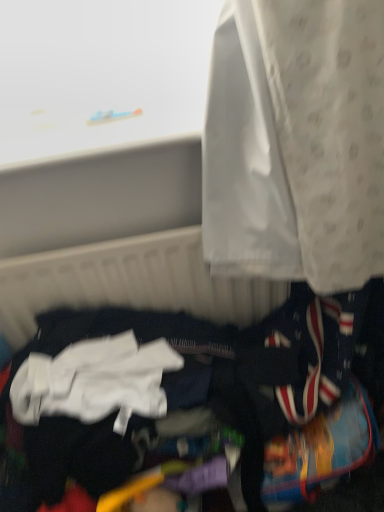
Looking at this image, what is the approximate width of white fabric at lower left?

white fabric at lower left is 16.82 inches wide.

The image size is (384, 512). What do you see at coordinates (208, 396) in the screenshot? I see `white fabric at lower left` at bounding box center [208, 396].

Image resolution: width=384 pixels, height=512 pixels. In order to click on white fabric at lower left in this screenshot , I will do `click(208, 396)`.

You are a GUI agent. You are given a task and a screenshot of the screen. Output one action in this format:
    pyautogui.click(x=<x>, y=<y>)
    Task: Click on the white fabric at lower left
    The image size is (384, 512).
    Given the screenshot: What is the action you would take?
    pyautogui.click(x=208, y=396)